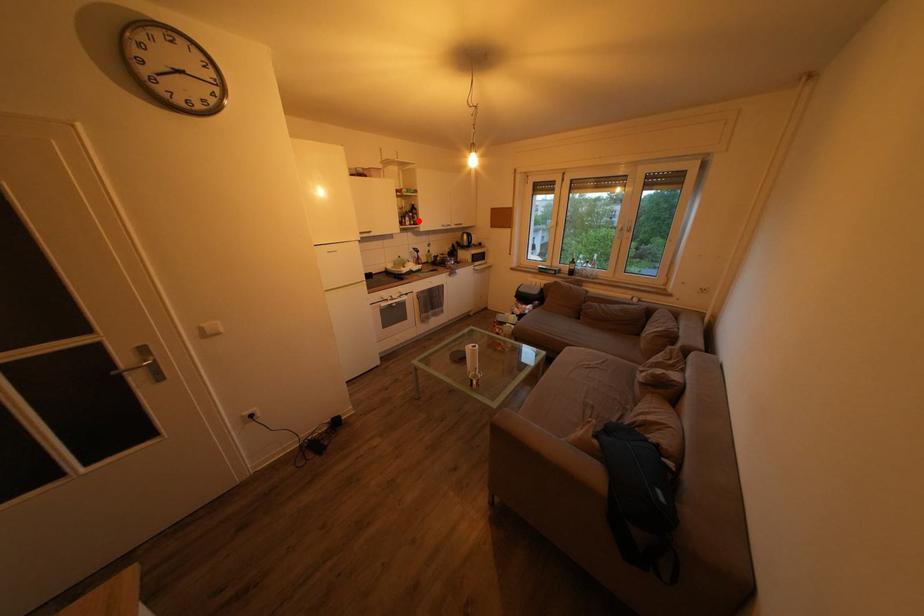
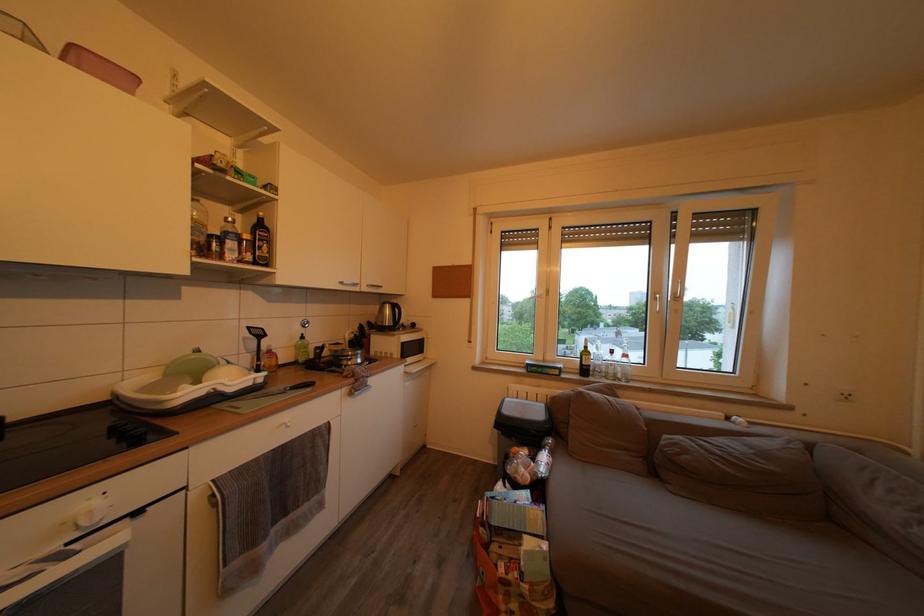
Question: I am providing you with two images of the same scene from different viewpoints. A red point is marked on the first image. At the location where the point appears in image 1, is it still visible in image 2?

Choices:
 (A) Yes
 (B) No

Answer: (A)